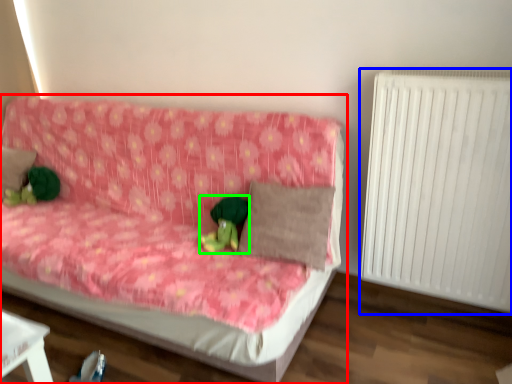
Question: Estimate the real-world distances between objects in this image. Which object is farther from studio couch (highlighted by a red box), radiator (highlighted by a blue box) or toy (highlighted by a green box)?

Choices:
 (A) radiator
 (B) toy

Answer: (A)